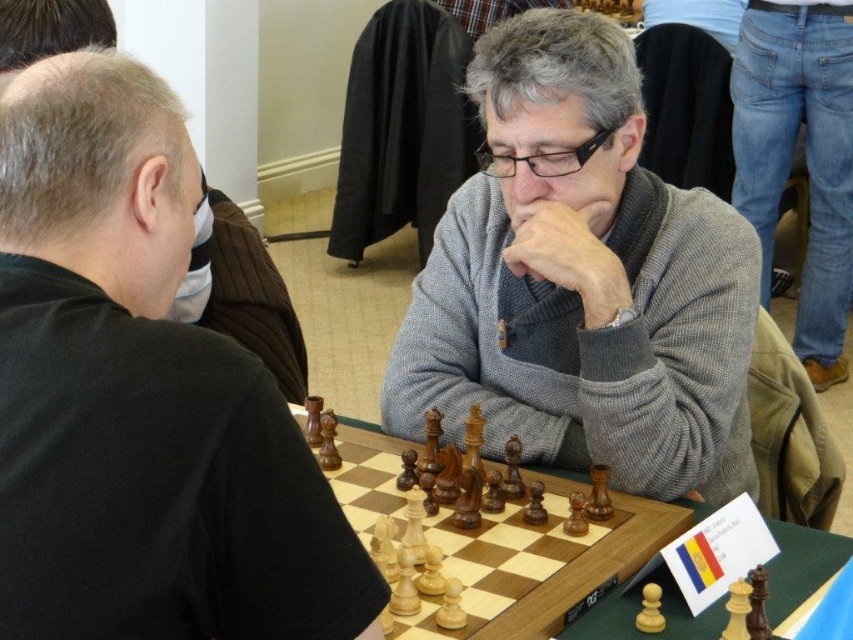
You are a chess player who wants to move your black matte chess pieces at left. However, there is a gray wool sweater at center blocking your path. Can you move your pieces without moving the sweater?

The black matte chess pieces at left is positioned under gray wool sweater at center, so you can move your pieces without moving the sweater since they are underneath it.

You are a chess player who wants to move a chess piece from the black matte chess pieces at left to the gray wool sweater at center. Is the distance between them sufficient for you to reach the sweater with your hand while keeping the piece in your hand?

The black matte chess pieces at left and gray wool sweater at center are 28.61 inches apart. Since the average human arm span is about 30 inches, the distance is slightly less than the average reach, so it might be possible to reach with a stretch.

You are a chess player standing at the center of the table. You want to move a piece from the black matte chess pieces at left to the position marked by point (140, 396). Is this a valid move?

The black matte chess pieces at left is represented by point (140, 396), so moving a piece from the black matte chess pieces at left to that position would mean moving it to its current location, which is not a valid move.